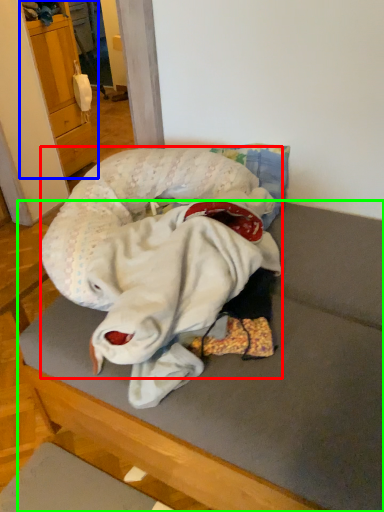
Question: Which is nearer to the baby (highlighted by a red box)? cabinetry (highlighted by a blue box) or furniture (highlighted by a green box).

Choices:
 (A) cabinetry
 (B) furniture

Answer: (B)